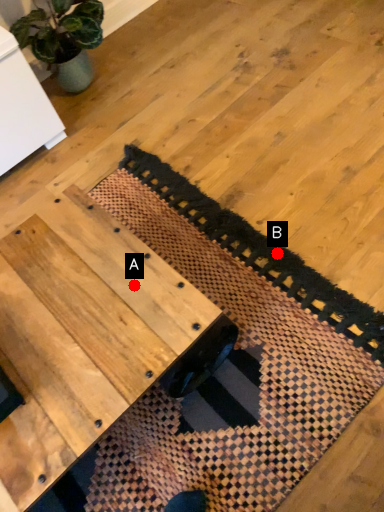
Question: Two points are circled on the image, labeled by A and B beside each circle. Among these points, which one is farthest from the camera?

Choices:
 (A) A is further
 (B) B is further

Answer: (B)